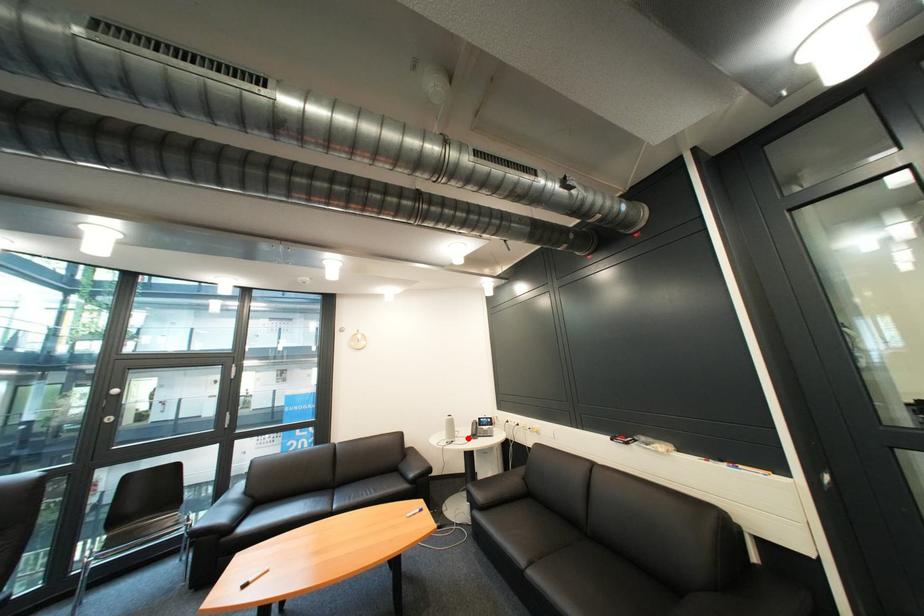
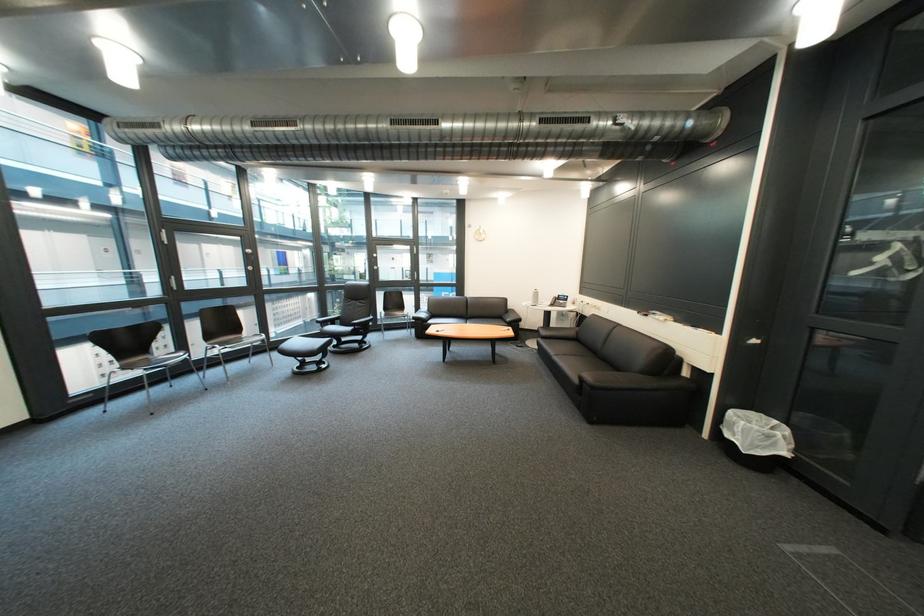
Locate, in the second image, the point that corresponds to the highlighted location in the first image.

(552, 305)